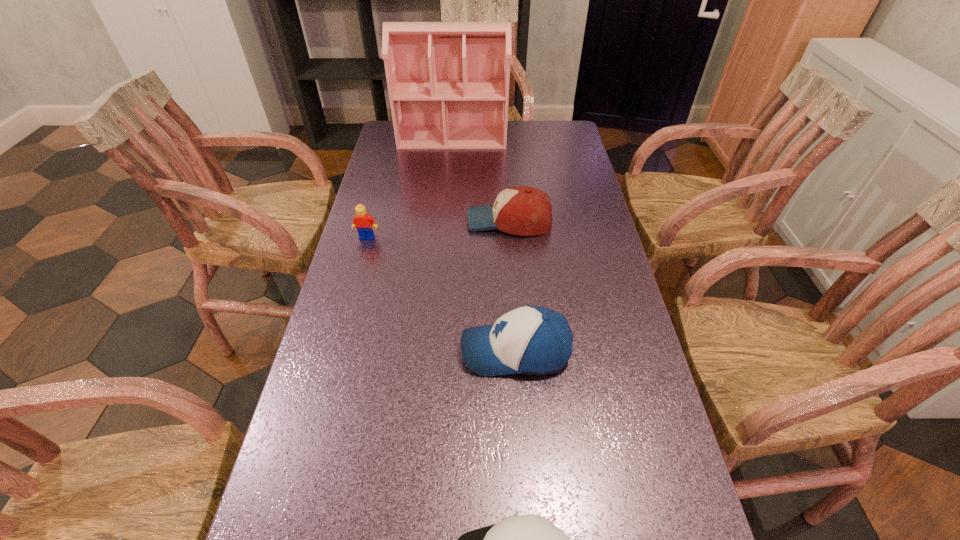
Where is `the farthest object`? the farthest object is located at coordinates (448, 82).

Locate an element on the screen. This screenshot has width=960, height=540. the tallest object is located at coordinates (448, 82).

Locate an element on the screen. The image size is (960, 540). the second farthest baseball cap is located at coordinates (535, 340).

Image resolution: width=960 pixels, height=540 pixels. I want to click on the farthest baseball cap, so click(519, 210).

Locate an element on the screen. Lego is located at coordinates (362, 221).

Where is `free region located 0.210m on the front-facing side of the dollhouse`? free region located 0.210m on the front-facing side of the dollhouse is located at coordinates (448, 183).

Where is `vacant space located on the front-facing side of the second farthest baseball cap`? The height and width of the screenshot is (540, 960). vacant space located on the front-facing side of the second farthest baseball cap is located at coordinates (383, 351).

Image resolution: width=960 pixels, height=540 pixels. I want to click on blank space located on the front-facing side of the second farthest baseball cap, so click(339, 351).

This screenshot has width=960, height=540. Identify the location of vacant space located 0.080m on the front-facing side of the second farthest baseball cap. (426, 351).

Identify the location of free location located 0.310m on the front-facing side of the farthest baseball cap. (365, 221).